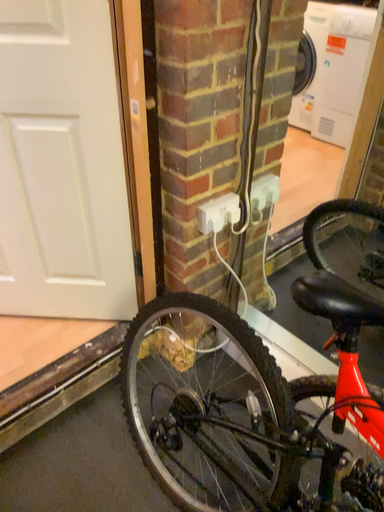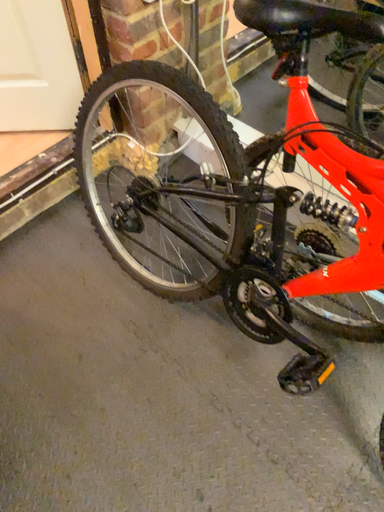
Question: How did the camera likely rotate when shooting the video?

Choices:
 (A) rotated upward
 (B) rotated downward

Answer: (B)